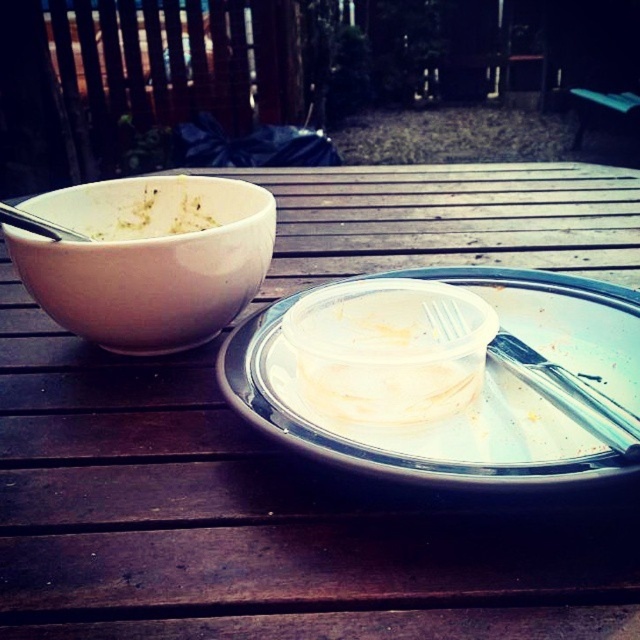
Question: Which object appears closest to the camera in this image?

Choices:
 (A) metallic silver fork at center
 (B) wooden table at center

Answer: (B)

Question: Is clear plastic container at center positioned behind silver metallic fork at left?

Choices:
 (A) no
 (B) yes

Answer: (A)

Question: Does wooden table at center have a larger size compared to clear plastic container at center?

Choices:
 (A) yes
 (B) no

Answer: (A)

Question: Is white matte bowl at left smaller than white creamy pasta at left?

Choices:
 (A) yes
 (B) no

Answer: (B)

Question: Estimate the real-world distances between objects in this image. Which object is farther from the wooden table at center?

Choices:
 (A) metallic silver fork at center
 (B) silver metallic fork at left
 (C) white creamy pasta at left

Answer: (B)

Question: Which point is closer to the camera taking this photo?

Choices:
 (A) (65, 237)
 (B) (384, 180)
 (C) (509, 321)

Answer: (A)